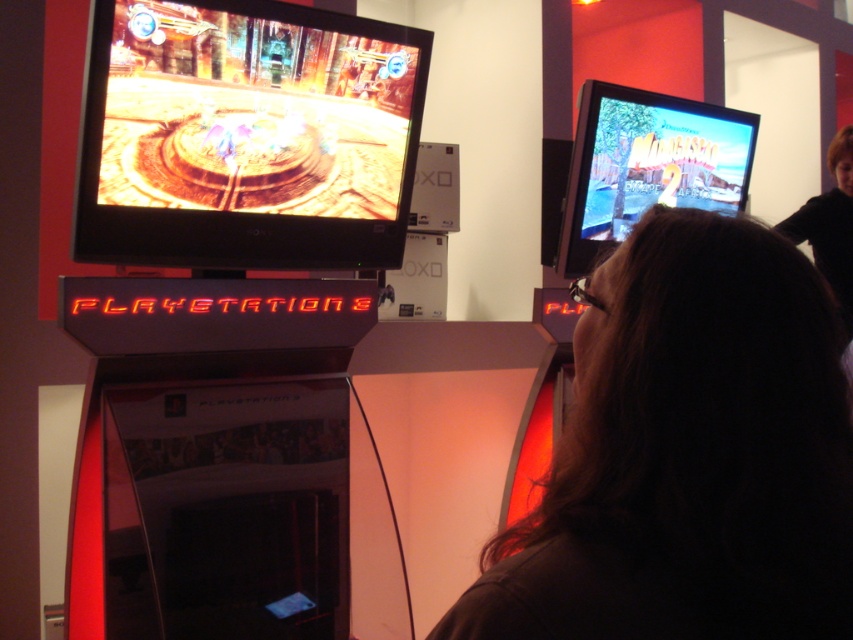
Question: Among these points, which one is farthest from the camera?

Choices:
 (A) (782, 547)
 (B) (321, 115)

Answer: (B)

Question: Among these points, which one is farthest from the camera?

Choices:
 (A) (277, 202)
 (B) (706, 381)

Answer: (A)

Question: Is dark brown hair at center wider than shiny metallic tv at upper left?

Choices:
 (A) yes
 (B) no

Answer: (B)

Question: Which of the following is the closest to the observer?

Choices:
 (A) (79, 250)
 (B) (799, 616)

Answer: (B)

Question: Does dark brown hair at center have a smaller size compared to shiny metallic tv at upper left?

Choices:
 (A) yes
 (B) no

Answer: (A)

Question: Can you confirm if dark brown hair at center is positioned below shiny metallic tv at upper left?

Choices:
 (A) yes
 (B) no

Answer: (A)